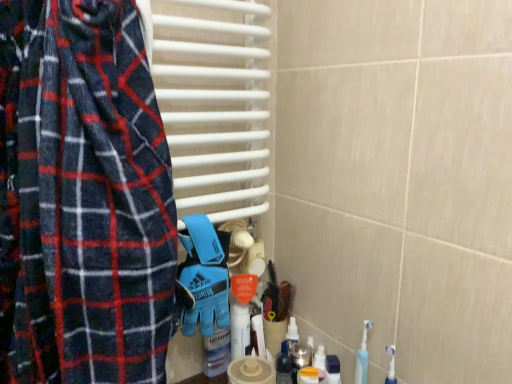
Question: Does white glossy bottle at center appear on the left side of blue synthetic glove at center?

Choices:
 (A) no
 (B) yes

Answer: (A)

Question: Would you say white glossy bottle at center contains blue synthetic glove at center?

Choices:
 (A) no
 (B) yes

Answer: (A)

Question: Could you tell me if white glossy bottle at center is turned towards blue synthetic glove at center?

Choices:
 (A) yes
 (B) no

Answer: (B)

Question: From a real-world perspective, is white glossy bottle at center positioned over blue synthetic glove at center based on gravity?

Choices:
 (A) no
 (B) yes

Answer: (A)

Question: From the image's perspective, is white glossy bottle at center above blue synthetic glove at center?

Choices:
 (A) yes
 (B) no

Answer: (B)

Question: Choose the correct answer: Is blue synthetic glove at center inside translucent plastic bottle at lower center or outside it?

Choices:
 (A) inside
 (B) outside

Answer: (B)

Question: In terms of size, does blue synthetic glove at center appear bigger or smaller than translucent plastic bottle at lower center?

Choices:
 (A) big
 (B) small

Answer: (A)

Question: Is point (226, 304) positioned closer to the camera than point (286, 367)?

Choices:
 (A) closer
 (B) farther

Answer: (A)

Question: From their relative heights in the image, would you say blue synthetic glove at center is taller or shorter than translucent plastic bottle at lower center?

Choices:
 (A) tall
 (B) short

Answer: (A)

Question: Is point [284, 360] positioned closer to the camera than point [236, 314]?

Choices:
 (A) closer
 (B) farther

Answer: (B)

Question: Looking at their shapes, would you say translucent plastic bottle at lower center is wider or thinner than white glossy bottle at center?

Choices:
 (A) thin
 (B) wide

Answer: (A)

Question: In terms of height, does translucent plastic bottle at lower center look taller or shorter compared to white glossy bottle at center?

Choices:
 (A) tall
 (B) short

Answer: (B)

Question: Considering the relative positions of translucent plastic bottle at lower center and white glossy bottle at center in the image provided, is translucent plastic bottle at lower center to the left or to the right of white glossy bottle at center?

Choices:
 (A) left
 (B) right

Answer: (B)

Question: Is point (245, 324) positioned closer to the camera than point (225, 254)?

Choices:
 (A) farther
 (B) closer

Answer: (A)

Question: In terms of height, does white glossy bottle at center look taller or shorter compared to blue synthetic glove at center?

Choices:
 (A) short
 (B) tall

Answer: (A)